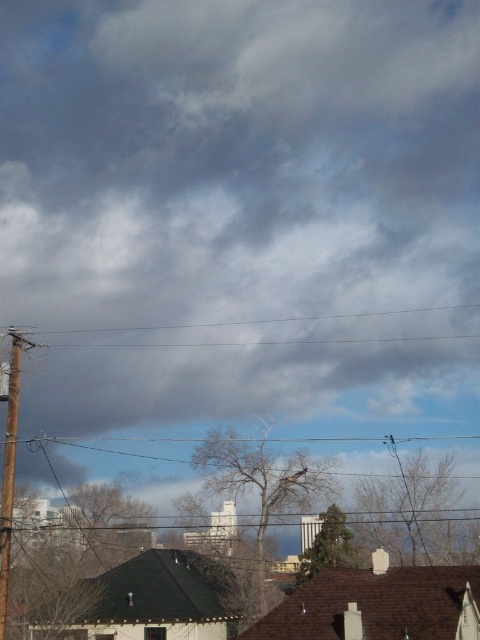
You are a bird flying over the scene and want to land on the highest point between the brown wooden telegraph pole at left and the wooden post at left. Which one should you choose?

The wooden post at left is higher because the brown wooden telegraph pole at left is located below it.

You are a bird flying over the city and see the brown wooden telegraph pole at left represented by point (9, 472). Based on the coordinates, is the pole closer to the top or bottom of the image?

The brown wooden telegraph pole at left is represented by point (9, 472). Since the y coordinate is 0.019, which is closer to the bottom of the image, the pole is closer to the bottom.